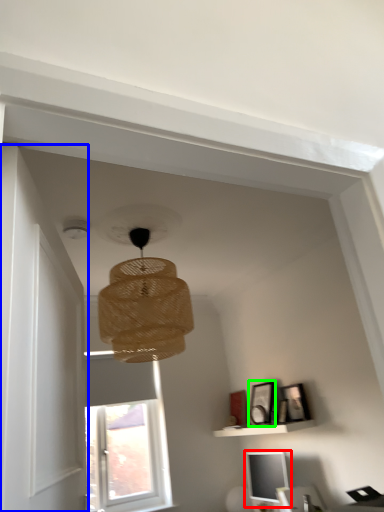
Question: Considering the real-world distances, which object is closest to computer monitor (highlighted by a red box)? door (highlighted by a blue box) or picture frame (highlighted by a green box).

Choices:
 (A) door
 (B) picture frame

Answer: (B)